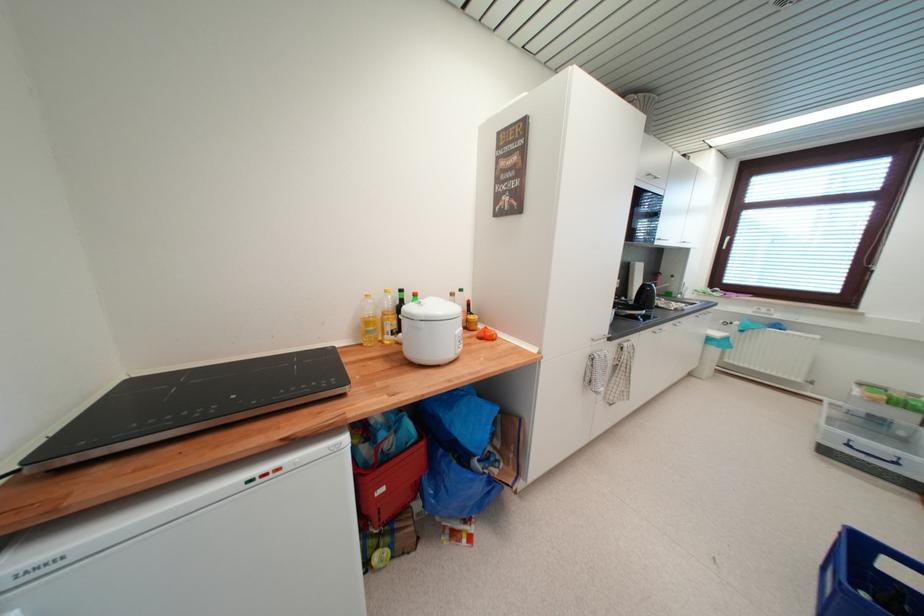
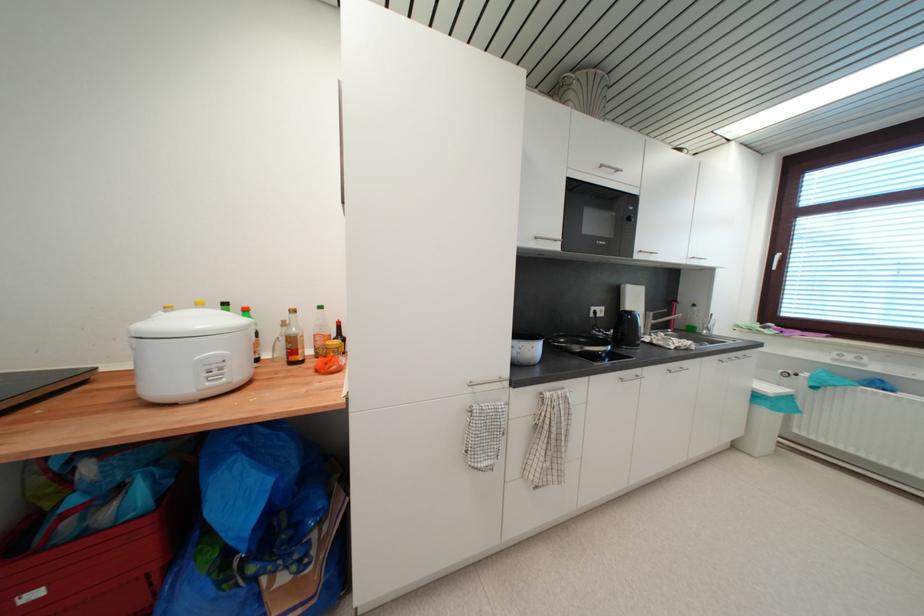
Question: The camera is either moving clockwise (left) or counter-clockwise (right) around the object. The first image is from the beginning of the video and the second image is from the end. Is the camera moving left or right when shooting the video?

Choices:
 (A) Left
 (B) Right

Answer: (B)